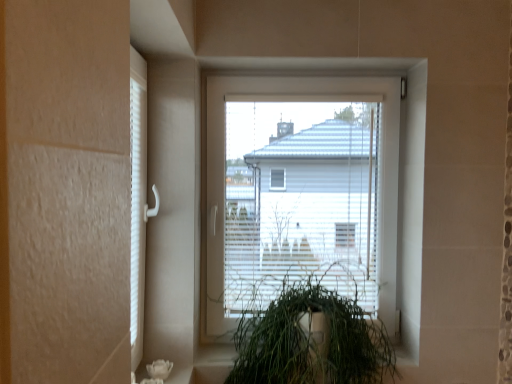
Question: Is point pyautogui.click(x=223, y=274) positioned closer to the camera than point pyautogui.click(x=357, y=377)?

Choices:
 (A) closer
 (B) farther

Answer: (B)

Question: In the image, is white plastic window at center positioned in front of or behind green leafy plant at center?

Choices:
 (A) front
 (B) behind

Answer: (B)

Question: Is white plastic window at center bigger or smaller than green leafy plant at center?

Choices:
 (A) small
 (B) big

Answer: (A)

Question: Considering the positions of point (373, 322) and point (266, 170), is point (373, 322) closer or farther from the camera than point (266, 170)?

Choices:
 (A) closer
 (B) farther

Answer: (A)

Question: Visually, is green leafy plant at center positioned to the left or to the right of white plastic window at center?

Choices:
 (A) left
 (B) right

Answer: (A)

Question: Considering the positions of green leafy plant at center and white plastic window at center in the image, is green leafy plant at center bigger or smaller than white plastic window at center?

Choices:
 (A) small
 (B) big

Answer: (B)

Question: From a real-world perspective, relative to white plastic window at center, is green leafy plant at center vertically above or below?

Choices:
 (A) below
 (B) above

Answer: (A)